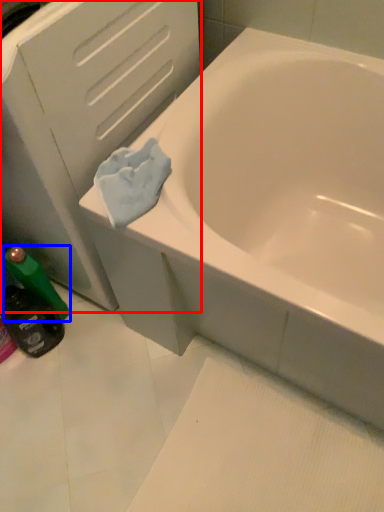
Question: Which object appears farthest to the camera in this image, file cabinet (highlighted by a red box) or mouthwash (highlighted by a blue box)?

Choices:
 (A) file cabinet
 (B) mouthwash

Answer: (B)